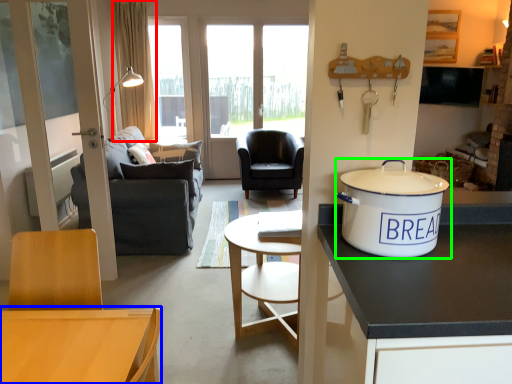
Question: Based on their relative distances, which object is farther from curtain (highlighted by a red box)? Choose from desk (highlighted by a blue box) and tableware (highlighted by a green box).

Choices:
 (A) desk
 (B) tableware

Answer: (B)